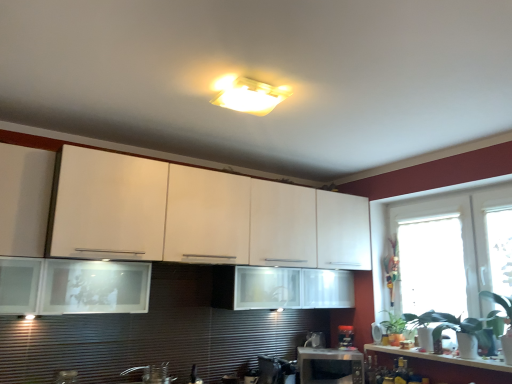
Question: Does black plastic toaster at lower center, which is counted as the third appliance, starting from the left, have a greater height compared to matte plastic light fixture at center?

Choices:
 (A) no
 (B) yes

Answer: (B)

Question: Is black plastic toaster at lower center, which is counted as the third appliance, starting from the left, at the left side of matte plastic light fixture at center?

Choices:
 (A) no
 (B) yes

Answer: (A)

Question: From a real-world perspective, is black plastic toaster at lower center, which is counted as the third appliance, starting from the left, positioned under matte plastic light fixture at center based on gravity?

Choices:
 (A) yes
 (B) no

Answer: (A)

Question: Would you say black plastic toaster at lower center, which is counted as the third appliance, starting from the left, contains matte plastic light fixture at center?

Choices:
 (A) yes
 (B) no

Answer: (B)

Question: Could you tell me if black plastic toaster at lower center, which is counted as the third appliance, starting from the left, is facing matte plastic light fixture at center?

Choices:
 (A) no
 (B) yes

Answer: (A)

Question: Would you say green leafy plant at right is to the left or to the right of transparent glass window at right, the third window from the left, in the picture?

Choices:
 (A) left
 (B) right

Answer: (A)

Question: Looking at their shapes, would you say green leafy plant at right is wider or thinner than transparent glass window at right, positioned as the 1th window in right-to-left order?

Choices:
 (A) wide
 (B) thin

Answer: (A)

Question: From the image's perspective, is green leafy plant at right located above or below transparent glass window at right, the third window from the left?

Choices:
 (A) above
 (B) below

Answer: (B)

Question: Based on their sizes in the image, would you say green leafy plant at right is bigger or smaller than transparent glass window at right, positioned as the 1th window in right-to-left order?

Choices:
 (A) small
 (B) big

Answer: (A)

Question: Looking at the image, does transparent glass window at right, the second window when ordered from right to left, seem bigger or smaller compared to white glossy countertop at lower right?

Choices:
 (A) big
 (B) small

Answer: (A)

Question: From their relative heights in the image, would you say transparent glass window at right, the second window when ordered from right to left, is taller or shorter than white glossy countertop at lower right?

Choices:
 (A) short
 (B) tall

Answer: (B)

Question: Is transparent glass window at right, the second window when ordered from right to left, in front of or behind white glossy countertop at lower right in the image?

Choices:
 (A) behind
 (B) front

Answer: (A)

Question: Based on their positions, is transparent glass window at right, which ranks as the 2th window in left-to-right order, located to the left or right of white glossy countertop at lower right?

Choices:
 (A) left
 (B) right

Answer: (B)

Question: Is transparent glass window at right, the 1th window positioned from the left, taller or shorter than green leafy plant at right?

Choices:
 (A) short
 (B) tall

Answer: (B)

Question: Does point (431, 269) appear closer or farther from the camera than point (404, 324)?

Choices:
 (A) farther
 (B) closer

Answer: (A)